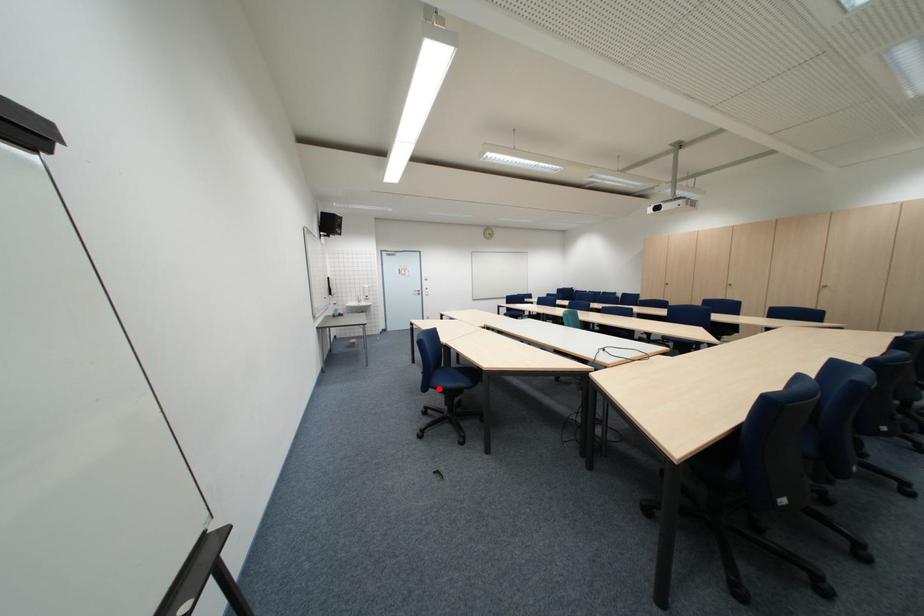
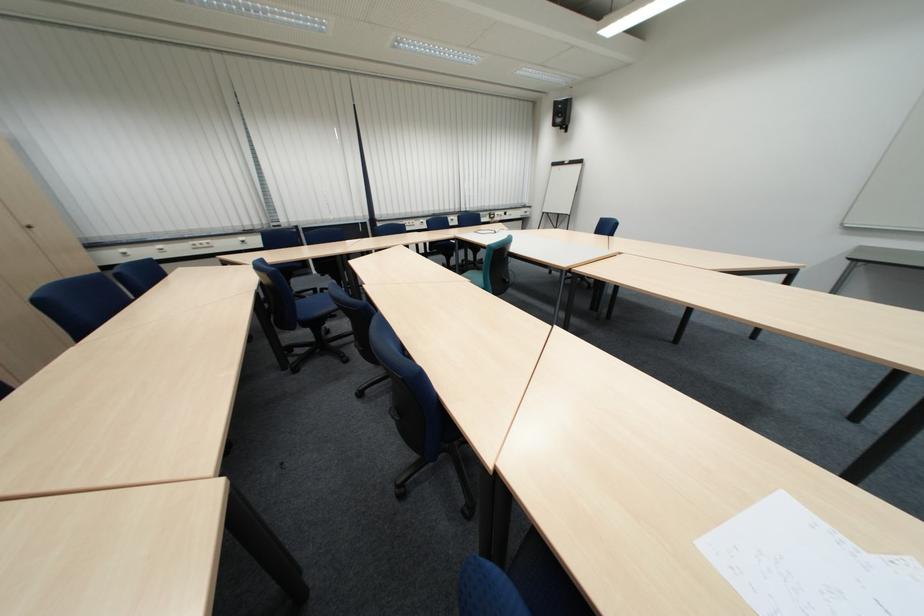
Question: I am providing you with two images of the same scene from different viewpoints. A red point is marked on the first image. Can you still see the location of the red point in image 2?

Choices:
 (A) Yes
 (B) No

Answer: (B)